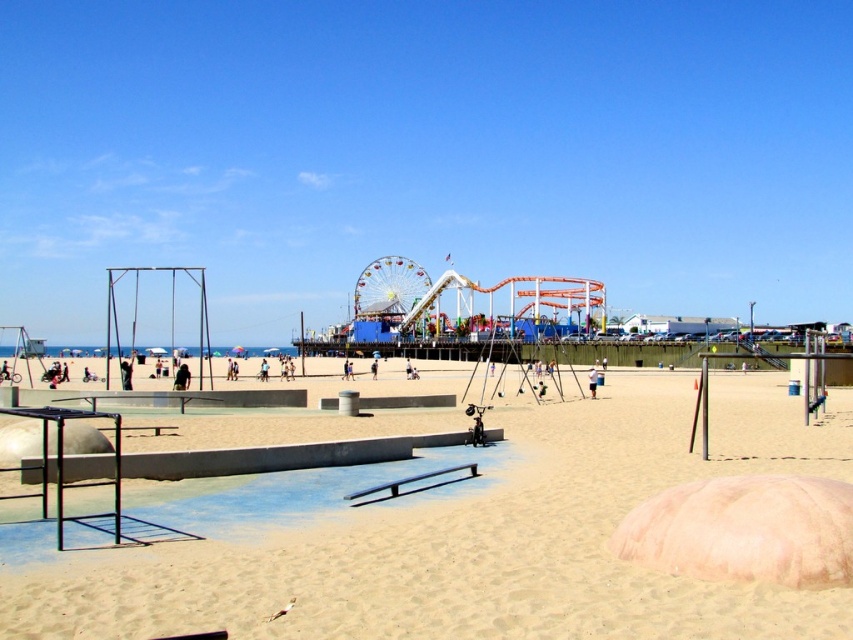
Which of these two, light brown sand at center or multicolored metallic ferris wheel at center, stands taller?

Standing taller between the two is multicolored metallic ferris wheel at center.

Is light brown sand at center to the left of multicolored metallic ferris wheel at center from the viewer's perspective?

In fact, light brown sand at center is to the right of multicolored metallic ferris wheel at center.

Which is in front, point (668, 612) or point (386, 291)?

Positioned in front is point (668, 612).

Where is `light brown sand at center`? This screenshot has width=853, height=640. light brown sand at center is located at coordinates (479, 541).